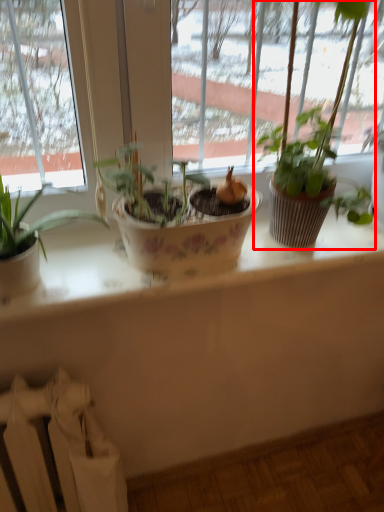
Question: Where is houseplant (annotated by the red box) located in relation to radiator in the image?

Choices:
 (A) right
 (B) left

Answer: (A)